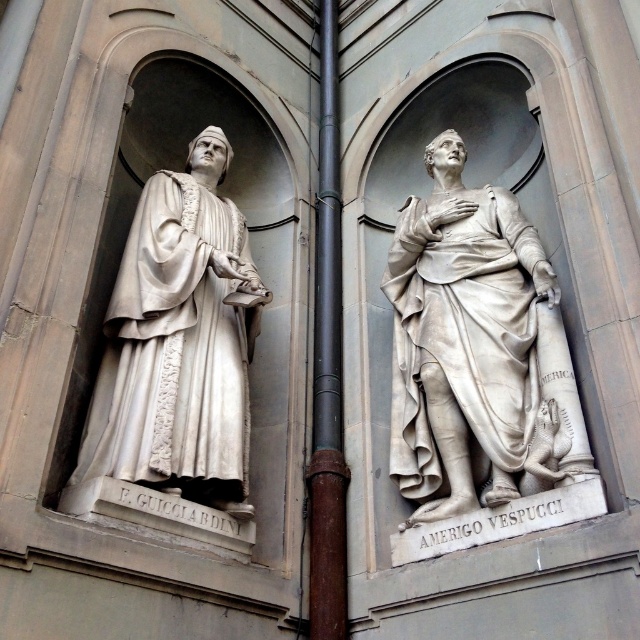
Question: Is white marble statue at center to the left of brown metal pipe at center from the viewer's perspective?

Choices:
 (A) yes
 (B) no

Answer: (B)

Question: Does white marble statue at center appear on the right side of white marble statue at left?

Choices:
 (A) no
 (B) yes

Answer: (B)

Question: Which point is farther to the camera?

Choices:
 (A) white marble statue at left
 (B) white marble statue at center
 (C) brown metal pipe at center

Answer: (C)

Question: Which point is closer to the camera?

Choices:
 (A) (500, 294)
 (B) (134, 394)

Answer: (B)

Question: Where is white marble statue at center located in relation to brown metal pipe at center in the image?

Choices:
 (A) below
 (B) above

Answer: (A)

Question: Estimate the real-world distances between objects in this image. Which object is closer to the brown metal pipe at center?

Choices:
 (A) white marble statue at center
 (B) white marble statue at left

Answer: (A)